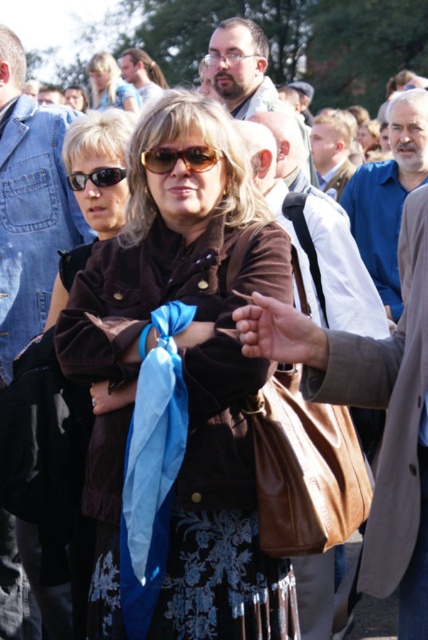
You are a photographer standing at the camera position. You want to capture a closeup shot of the brown leather jacket at center. Is the jacket within your camera range if your camera can focus up to 5 meters?

The brown leather jacket at center is 5.58 meters away from the camera, which is beyond the camera focus range of 5 meters. Therefore, the jacket is out of focus range.